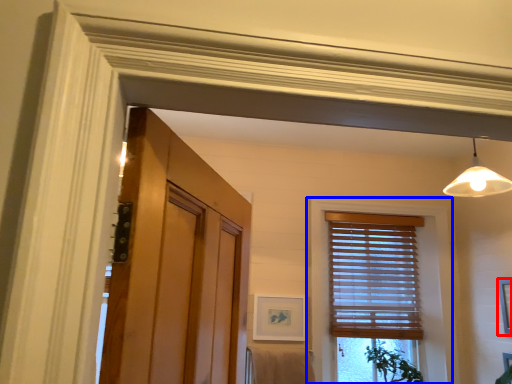
Question: Which object appears closest to the camera in this image, picture frame (highlighted by a red box) or window (highlighted by a blue box)?

Choices:
 (A) picture frame
 (B) window

Answer: (A)